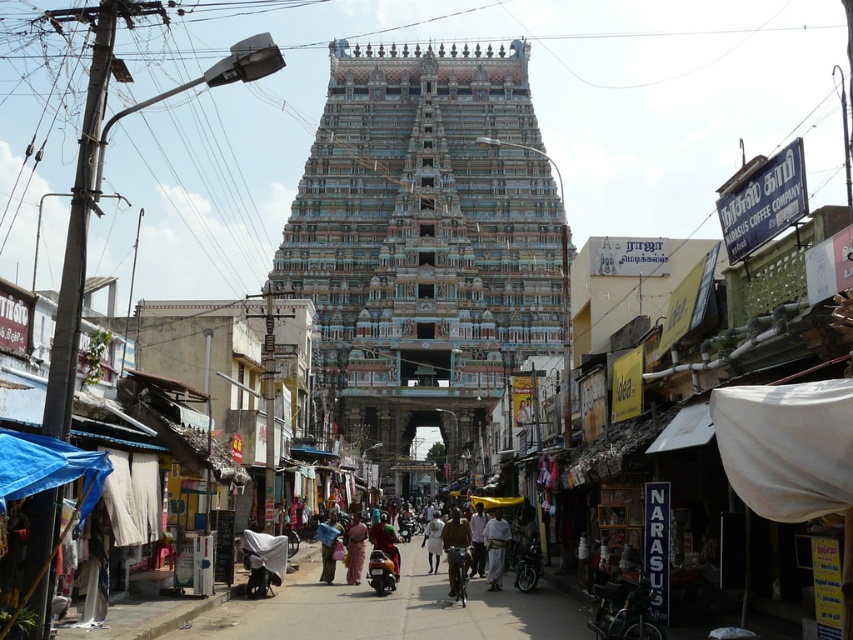
You are a photographer standing at the edge of the street. You want to take a photo of the white cotton dress at center without the blue tarpaulin canopy at lower left appearing in the background. Is the dress tall enough to block the view of the canopy?

The blue tarpaulin canopy at lower left is much taller than the white cotton dress at center. Therefore, the dress cannot block the view of the canopy as it is shorter than the canopy.

You are a tourist walking along the street in the scene. You want to buy a multicolored saree. Which direction should you walk relative to the blue tarpaulin canopy at lower left to reach the multicolored saree at center?

The blue tarpaulin canopy at lower left is in front of the multicolored saree at center, so you should walk behind the blue tarpaulin canopy at lower left to reach the multicolored saree at center.

You are a tourist standing at the entrance of the temple and want to find the blue tarpaulin canopy at lower left. According to the coordinates provided, where should you look relative to your position?

The blue tarpaulin canopy at lower left is located at point coordinates, so you should look towards the lower left direction from your current position at the temple entrance.